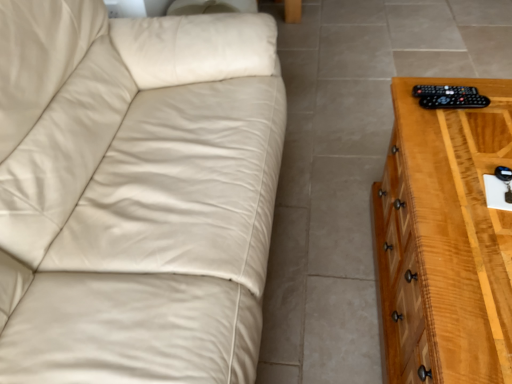
Question: Should I look upward or downward to see black plastic remote at right?

Choices:
 (A) down
 (B) up

Answer: (B)

Question: Is light brown wooden chest of drawers at right beside black plastic remote at right?

Choices:
 (A) no
 (B) yes

Answer: (A)

Question: Is light brown wooden chest of drawers at right smaller than black plastic remote at right?

Choices:
 (A) no
 (B) yes

Answer: (A)

Question: Is light brown wooden chest of drawers at right to the right of black plastic remote at right from the viewer's perspective?

Choices:
 (A) no
 (B) yes

Answer: (B)

Question: Does light brown wooden chest of drawers at right turn towards black plastic remote at right?

Choices:
 (A) no
 (B) yes

Answer: (A)

Question: Is there a large distance between light brown wooden chest of drawers at right and black plastic remote at right?

Choices:
 (A) no
 (B) yes

Answer: (A)

Question: Is light brown wooden chest of drawers at right behind black plastic remote at right?

Choices:
 (A) yes
 (B) no

Answer: (B)

Question: Would you consider black plastic remote at right to be distant from light brown wooden chest of drawers at right?

Choices:
 (A) no
 (B) yes

Answer: (A)

Question: Is black plastic remote at right taller than light brown wooden chest of drawers at right?

Choices:
 (A) yes
 (B) no

Answer: (B)

Question: Is black plastic remote at right positioned before light brown wooden chest of drawers at right?

Choices:
 (A) no
 (B) yes

Answer: (A)

Question: From a real-world perspective, is black plastic remote at right on top of light brown wooden chest of drawers at right?

Choices:
 (A) yes
 (B) no

Answer: (A)

Question: Can you confirm if black plastic remote at right is smaller than light brown wooden chest of drawers at right?

Choices:
 (A) yes
 (B) no

Answer: (A)

Question: Considering the relative sizes of black plastic remote at right and light brown wooden chest of drawers at right in the image provided, is black plastic remote at right shorter than light brown wooden chest of drawers at right?

Choices:
 (A) yes
 (B) no

Answer: (A)

Question: Considering the relative sizes of black plastic remote at right and black plastic remote at right in the image provided, is black plastic remote at right smaller than black plastic remote at right?

Choices:
 (A) no
 (B) yes

Answer: (A)